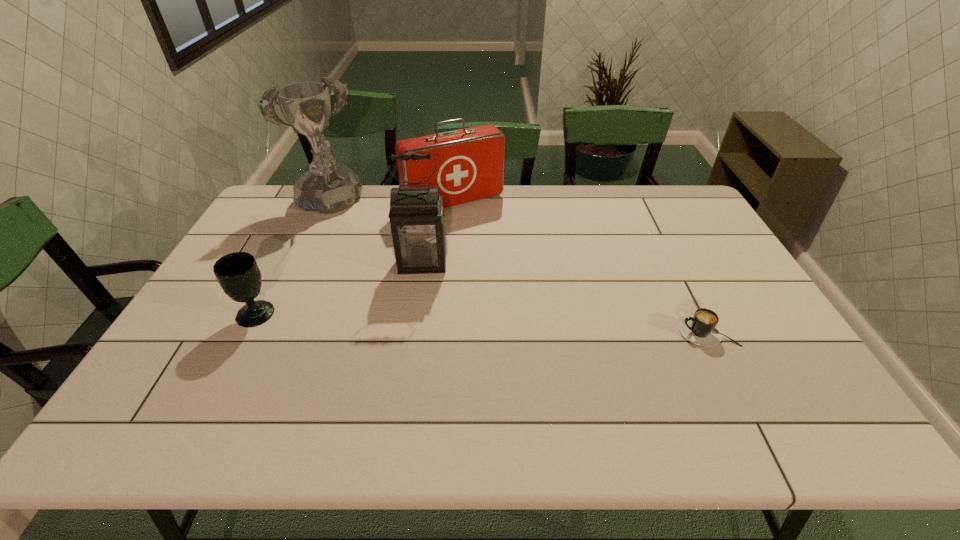
This screenshot has width=960, height=540. I want to click on free spot on the desktop that is between the fourth tallest object and the cappuccino and is positioned on the front-facing side of the third farthest object, so click(419, 321).

I want to click on vacant spot on the desktop that is between the chalice and the rightmost object and is positioned on the side with emblem of the award, so click(x=418, y=320).

At what (x,y) coordinates should I click in order to perform the action: click on vacant spot on the desktop that is between the chalice and the shortest object and is positioned on the side of the third shortest object with the first aid cross symbol. Please return your answer as a coordinate pair (x, y). Looking at the image, I should click on (544, 326).